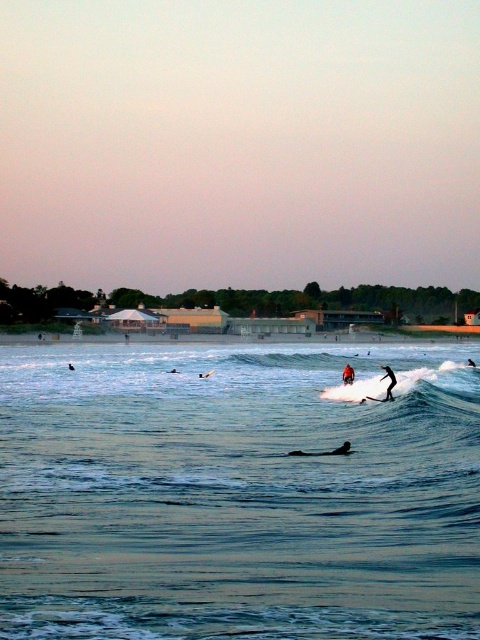
You are a photographer trying to capture the clear blue water at center and the white foam surfboard at center in a single shot. Based on their positions, which object should you focus on first to ensure both are in sharp focus?

The white foam surfboard at center is further away than the clear blue water at center, so you should focus on the white foam surfboard at center first to ensure both are in sharp focus.

You are a surfer who wants to paddle out to the white foam surfboard at center from the clear blue water at center. Considering the distance between them, can you estimate how long it would take you to reach the surfboard if you paddle at a speed of 0.5 meters per second?

The distance between the clear blue water at center and the white foam surfboard at center is 14.68 meters. At a paddling speed of 0.5 meters per second, it would take approximately 29.36 seconds to reach the surfboard.